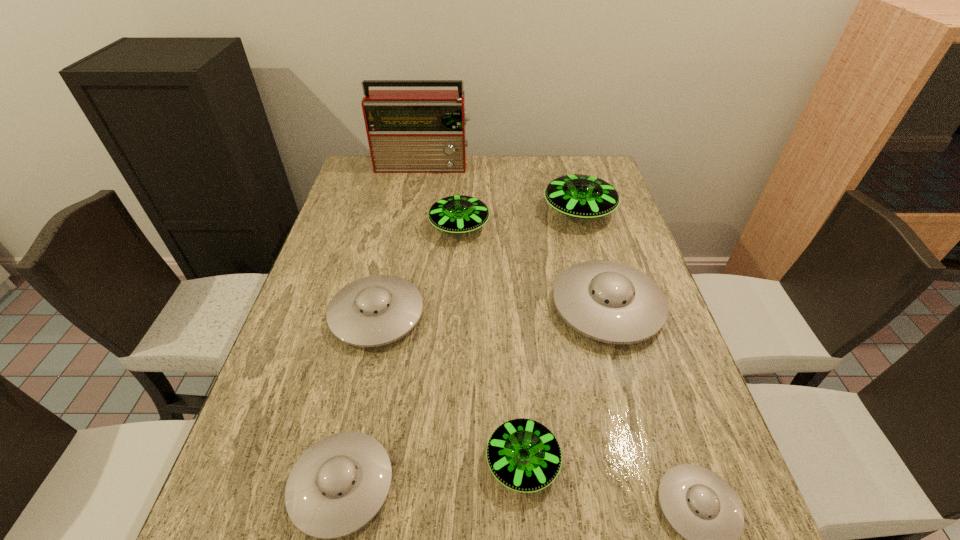
The height and width of the screenshot is (540, 960). I want to click on free space between the second tallest object and the third smallest gray saucer, so click(x=478, y=263).

The height and width of the screenshot is (540, 960). In order to click on object that is the seventh closest to the rightmost green saucer in this screenshot , I will do `click(338, 485)`.

The width and height of the screenshot is (960, 540). What are the coordinates of `the closest object to the tallest saucer` in the screenshot? It's located at (611, 302).

I want to click on saucer that is the fifth closest to the third smallest gray saucer, so click(x=581, y=196).

Locate an element on the screen. The image size is (960, 540). saucer that can be found as the third closest to the nearest green saucer is located at coordinates (611, 302).

Where is `green saucer that stands as the second closest to the nearest green saucer`? green saucer that stands as the second closest to the nearest green saucer is located at coordinates (581, 196).

Identify which green saucer is located as the second nearest to the second biggest green saucer. Please provide its 2D coordinates. Your answer should be formatted as a tuple, i.e. [(x, y)], where the tuple contains the x and y coordinates of a point satisfying the conditions above.

[(524, 455)]

Identify which gray saucer is located as the nearest to the second biggest green saucer. Please provide its 2D coordinates. Your answer should be formatted as a tuple, i.e. [(x, y)], where the tuple contains the x and y coordinates of a point satisfying the conditions above.

[(376, 310)]

Identify which gray saucer is located as the third nearest to the shortest saucer. Please provide its 2D coordinates. Your answer should be formatted as a tuple, i.e. [(x, y)], where the tuple contains the x and y coordinates of a point satisfying the conditions above.

[(376, 310)]

The height and width of the screenshot is (540, 960). What are the coordinates of `vacant space that satisfies the following two spatial constraints: 1. on the front side of the nearest green saucer; 2. on the left side of the second biggest green saucer` in the screenshot? It's located at (446, 462).